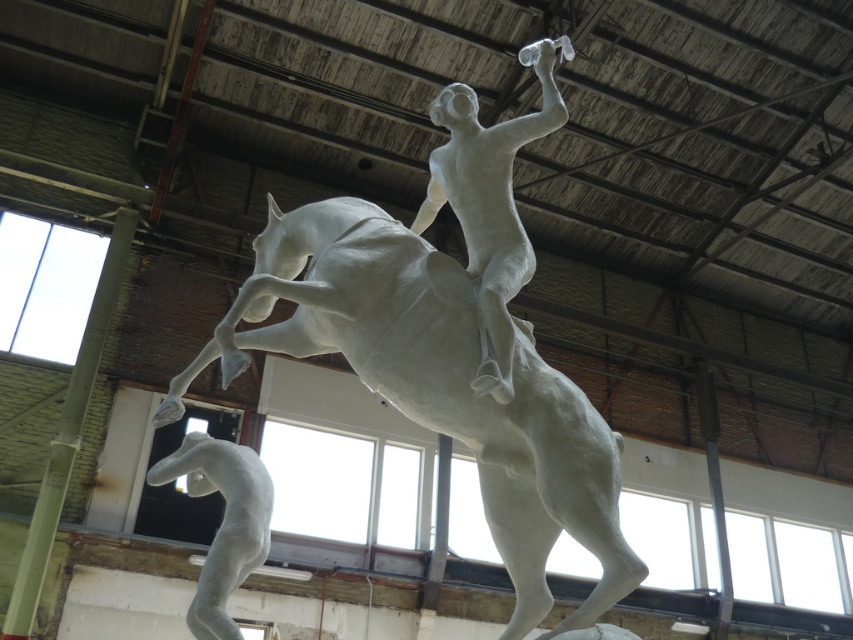
Question: Does white matte figure at center lie in front of white matte horse at lower left?

Choices:
 (A) yes
 (B) no

Answer: (A)

Question: Which object is positioned farthest from the white matte horse at lower left?

Choices:
 (A) white matte horse at center
 (B) white matte figure at center

Answer: (B)

Question: Which point appears closest to the camera in this image?

Choices:
 (A) (190, 444)
 (B) (550, 100)

Answer: (B)

Question: Which point is closer to the camera?

Choices:
 (A) white matte horse at lower left
 (B) white matte figure at center

Answer: (B)

Question: Is white matte horse at center positioned in front of white matte horse at lower left?

Choices:
 (A) yes
 (B) no

Answer: (A)

Question: Can you confirm if white matte horse at center is wider than white matte horse at lower left?

Choices:
 (A) yes
 (B) no

Answer: (A)